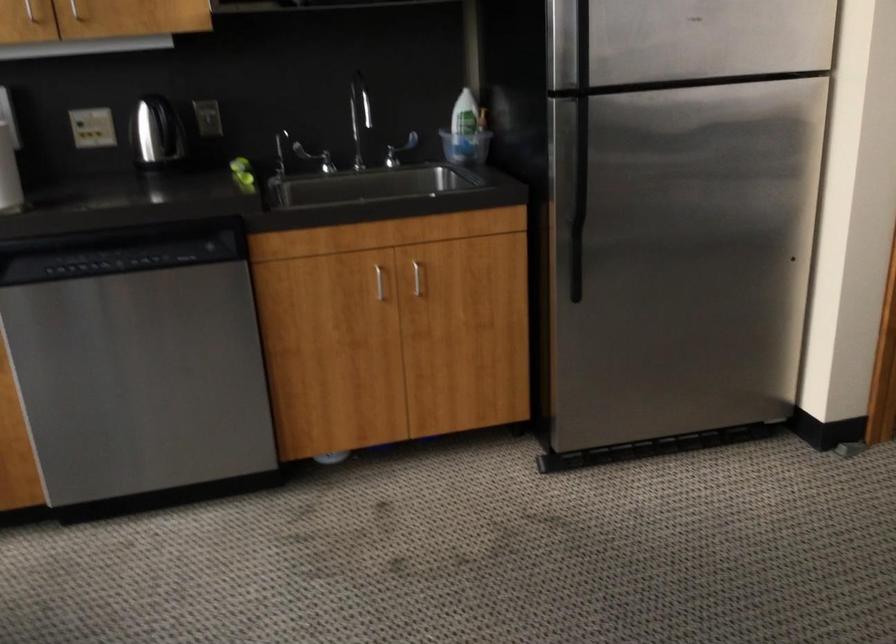
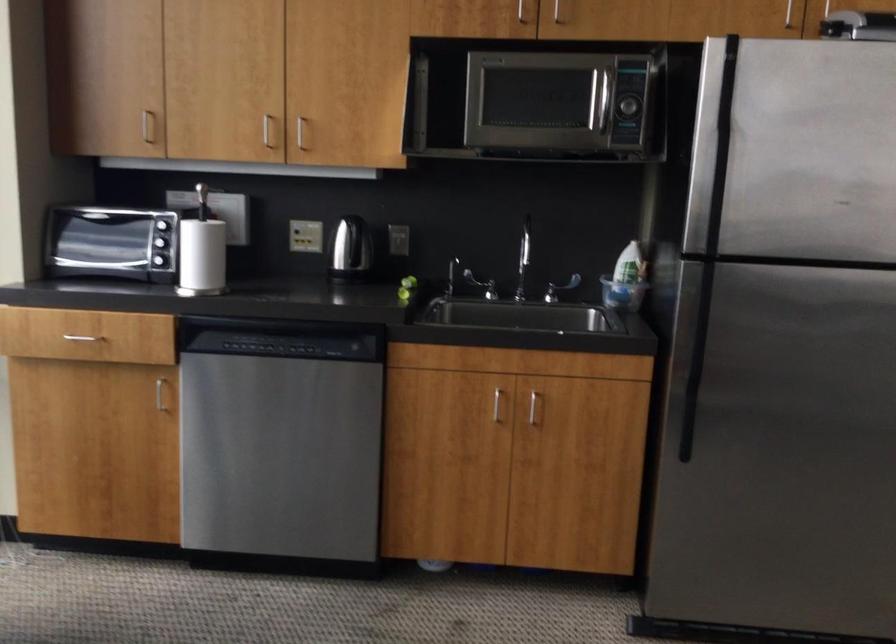
In the second image, find the point that corresponds to pixel 115 261 in the first image.

(277, 346)